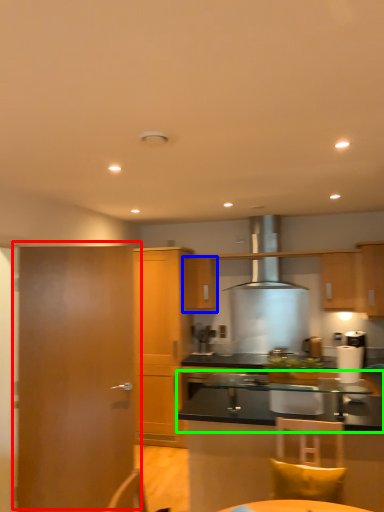
Question: Considering the real-world distances, which object is closest to door (highlighted by a red box)? cabinetry (highlighted by a blue box) or countertop (highlighted by a green box).

Choices:
 (A) cabinetry
 (B) countertop

Answer: (B)